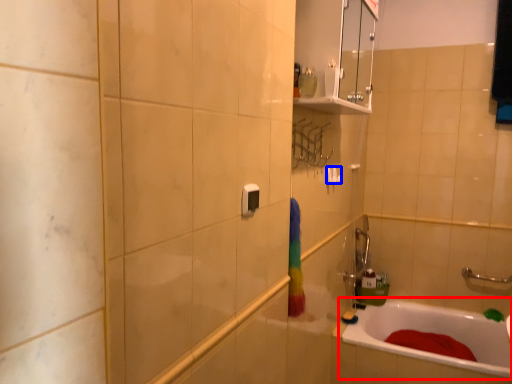
Question: Which of the following is the closest to the observer, bathtub (highlighted by a red box) or towel bar (highlighted by a blue box)?

Choices:
 (A) bathtub
 (B) towel bar

Answer: (A)